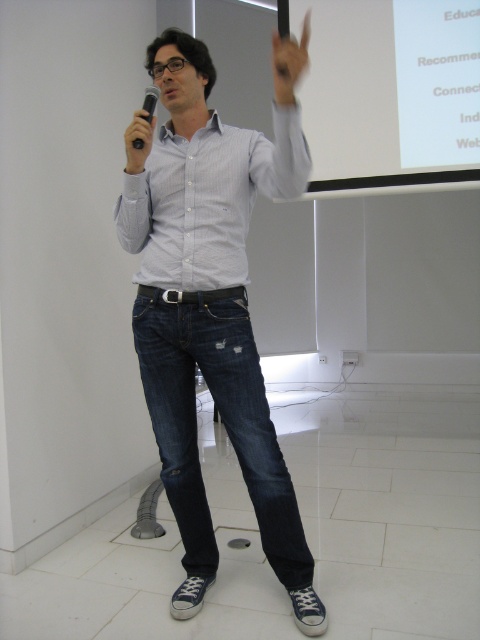
Question: Can you confirm if white striped shirt at center is smaller than matte black microphone at left?

Choices:
 (A) no
 (B) yes

Answer: (A)

Question: Which object is the farthest from the matte black microphone at left?

Choices:
 (A) white matte projection screen at upper center
 (B) white striped shirt at center
 (C) black matte microphone at left
 (D) dark blue denim jeans at center

Answer: (A)

Question: Among these points, which one is nearest to the camera?

Choices:
 (A) (428, 179)
 (B) (142, 140)
 (C) (287, 196)

Answer: (B)

Question: From the image, what is the correct spatial relationship of denim jeans at center in relation to dark blue denim jeans at center?

Choices:
 (A) below
 (B) above

Answer: (B)

Question: Based on their relative distances, which object is farther from the white striped shirt at center?

Choices:
 (A) white matte projection screen at upper center
 (B) matte black microphone at left

Answer: (A)

Question: Does denim jeans at center have a greater width compared to dark blue denim jeans at center?

Choices:
 (A) yes
 (B) no

Answer: (A)